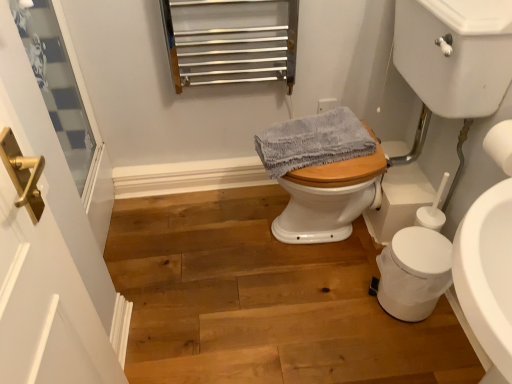
The height and width of the screenshot is (384, 512). I want to click on free spot in front of white matte trash can at lower right, so click(x=417, y=350).